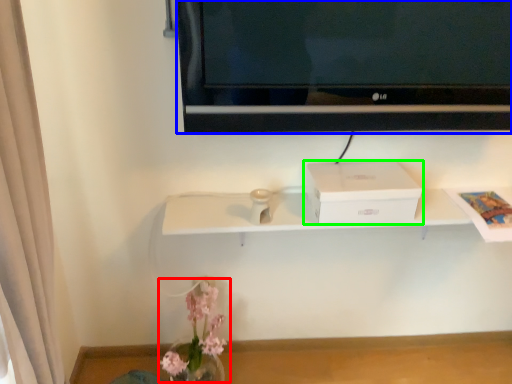
Question: Considering the real-world distances, which object is farthest from floral arrangement (highlighted by a red box)? television (highlighted by a blue box) or box (highlighted by a green box)?

Choices:
 (A) television
 (B) box

Answer: (A)